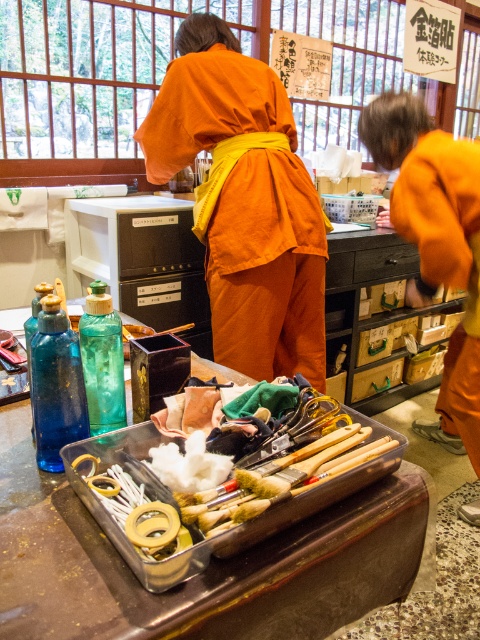
Question: Which point is closer to the camera?

Choices:
 (A) orange cotton kimono at center
 (B) orange cotton robe at right

Answer: (A)

Question: Which of these objects is positioned closest to the orange cotton robe at right?

Choices:
 (A) clear plastic tray at center
 (B) translucent green glass bottle at center

Answer: (A)

Question: Does clear plastic tray at center have a larger size compared to orange cotton robe at right?

Choices:
 (A) no
 (B) yes

Answer: (A)

Question: Does blue glass bottle at center have a larger size compared to translucent green glass bottle at center?

Choices:
 (A) no
 (B) yes

Answer: (A)

Question: Can you confirm if orange cotton kimono at center is bigger than orange cotton robe at right?

Choices:
 (A) yes
 (B) no

Answer: (B)

Question: Which point is closer to the camera?

Choices:
 (A) (225, 228)
 (B) (447, 227)
 (C) (80, 561)

Answer: (C)